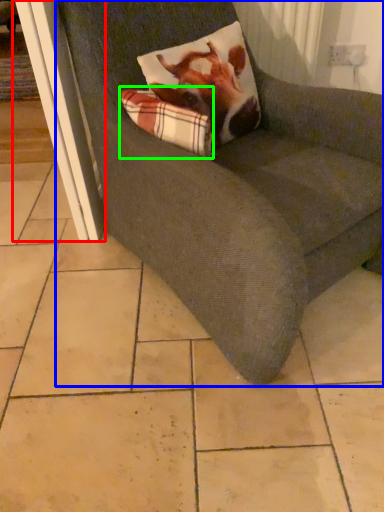
Question: Based on their relative distances, which object is nearer to screen door (highlighted by a red box)? Choose from chair (highlighted by a blue box) and plaid (highlighted by a green box).

Choices:
 (A) chair
 (B) plaid

Answer: (B)